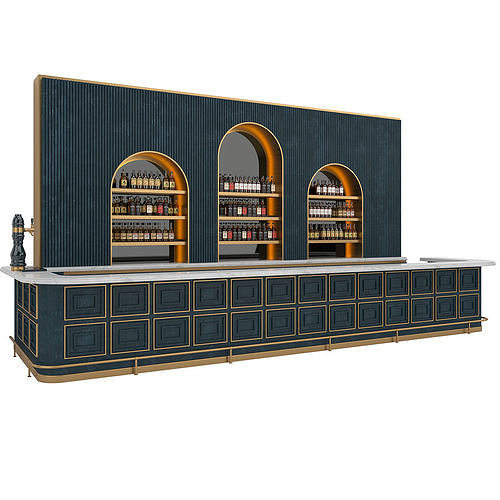
Find the location of a particular element. top right corner of back of bar back is located at coordinates (402, 123).